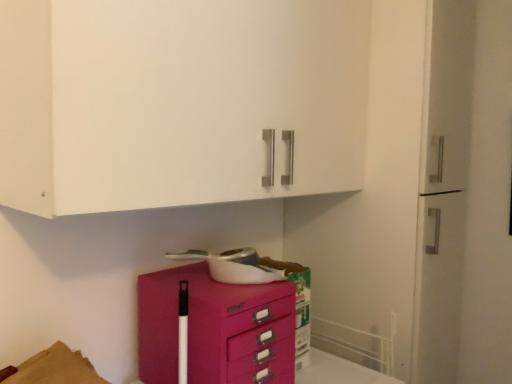
The height and width of the screenshot is (384, 512). What do you see at coordinates (216, 329) in the screenshot?
I see `matte pink chest of drawers at lower center` at bounding box center [216, 329].

At what (x,y) coordinates should I click in order to perform the action: click on matte pink chest of drawers at lower center. Please return your answer as a coordinate pair (x, y). The width and height of the screenshot is (512, 384). Looking at the image, I should click on (216, 329).

Locate an element on the screen. This screenshot has height=384, width=512. matte pink chest of drawers at lower center is located at coordinates (216, 329).